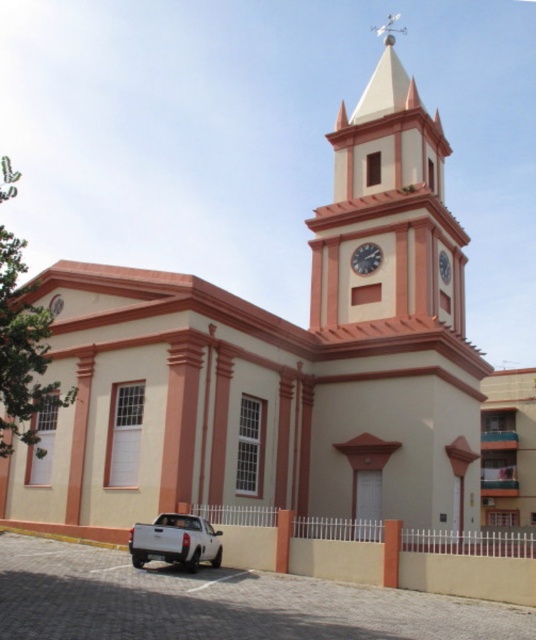
Does matte pink clock tower at upper center appear on the left side of white matte pickup truck at lower left?

No, matte pink clock tower at upper center is not to the left of white matte pickup truck at lower left.

Is matte pink clock tower at upper center to the right of white matte pickup truck at lower left from the viewer's perspective?

Yes, matte pink clock tower at upper center is to the right of white matte pickup truck at lower left.

Who is more distant from viewer, (331, 205) or (188, 513)?

The point (331, 205) is more distant.

Locate an element on the screen. Image resolution: width=536 pixels, height=640 pixels. matte pink clock tower at upper center is located at coordinates (386, 209).

Is white glossy clock at upper center below matte brown clock at upper center?

Actually, white glossy clock at upper center is above matte brown clock at upper center.

Can you confirm if white glossy clock at upper center is shorter than matte brown clock at upper center?

Indeed, white glossy clock at upper center has a lesser height compared to matte brown clock at upper center.

Is point (363, 250) farther from camera compared to point (446, 282)?

That is False.

Find the location of a particular element. This screenshot has height=640, width=536. white glossy clock at upper center is located at coordinates (366, 259).

Does matte pink clock tower at upper center lie in front of white glossy clock at upper center?

Yes, matte pink clock tower at upper center is in front of white glossy clock at upper center.

Who is more distant from viewer, (437, 218) or (353, 260)?

Point (353, 260)

The width and height of the screenshot is (536, 640). Identify the location of matte pink clock tower at upper center. click(386, 209).